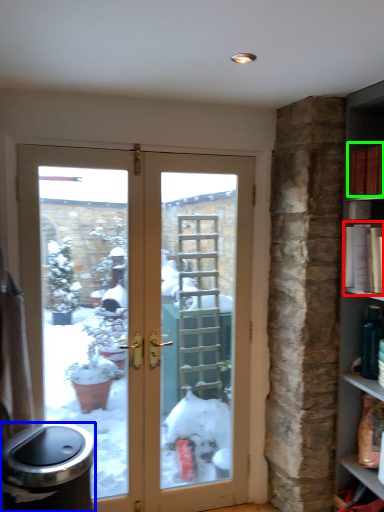
Question: Estimate the real-world distances between objects in this image. Which object is closer to book (highlighted by a red box), garbage (highlighted by a blue box) or book (highlighted by a green box)?

Choices:
 (A) garbage
 (B) book

Answer: (B)